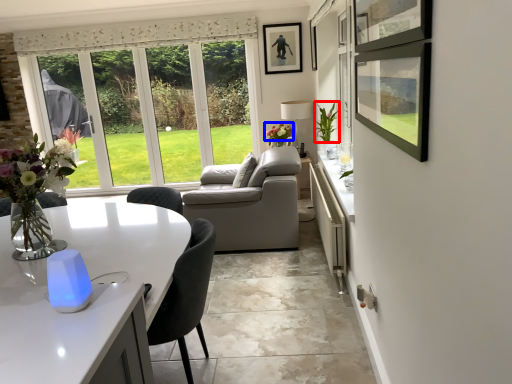
Question: Which point is closer to the camera, flower (highlighted by a red box) or flower (highlighted by a blue box)?

Choices:
 (A) flower
 (B) flower

Answer: (A)